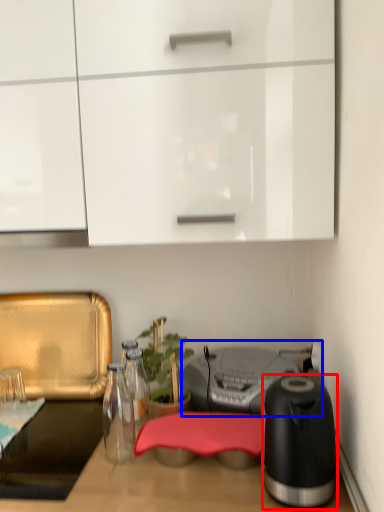
Question: Which point is further to the camera, kitchen appliance (highlighted by a red box) or appliance (highlighted by a blue box)?

Choices:
 (A) kitchen appliance
 (B) appliance

Answer: (B)